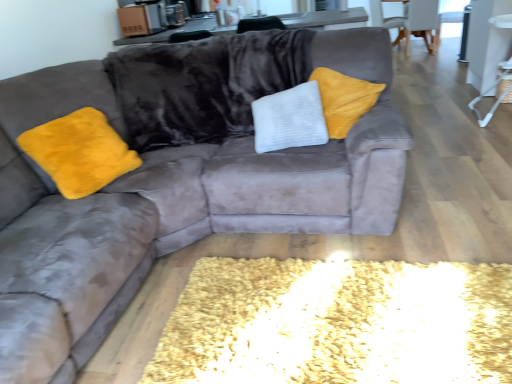
You are a GUI agent. You are given a task and a screenshot of the screen. Output one action in this format:
    pyautogui.click(x=<x>, y=<y>)
    Task: Click on the free space to the left of white plastic side table at right
    This screenshot has width=512, height=384.
    Given the screenshot: What is the action you would take?
    pyautogui.click(x=442, y=124)